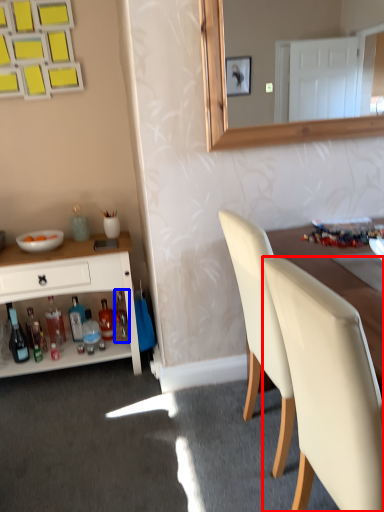
Question: Which object appears farthest to the camera in this image, chair (highlighted by a red box) or bottle (highlighted by a blue box)?

Choices:
 (A) chair
 (B) bottle

Answer: (B)